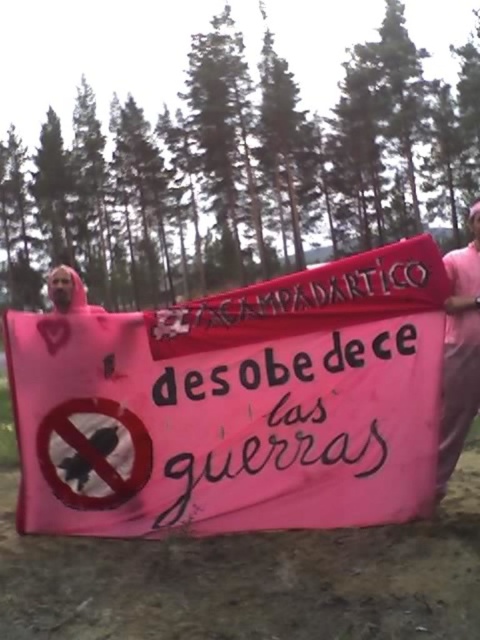
You are a photographer trying to capture the entire pink fabric banner at center and the pink fabric at center in one shot. Since both are pink, how can you distinguish between them in the photo?

The pink fabric banner at center is to the left of the pink fabric at center, so you can distinguish them by their positions in the photo.

You are a photographer trying to capture a clear shot of the pink fabric banner at center and the pink fabric at center. Since they are both pink, you want to ensure they are distinct in your photo. Is there enough space between them to make them easily distinguishable in the image?

The distance between the pink fabric banner at center and the pink fabric at center is 32.18 inches, which is sufficient to distinguish them in a photo as they are separate objects with space between them.